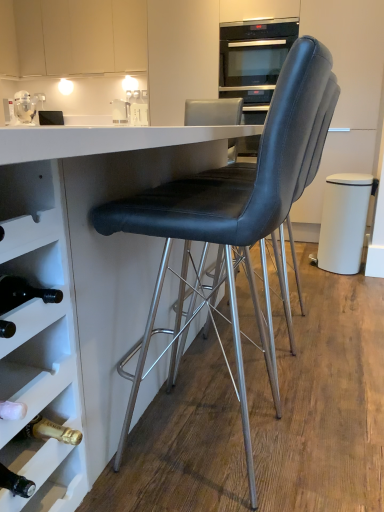
Where is `vacant region to the right of black leather chair at center, the 2th chair in the front-to-back sequence`? The image size is (384, 512). vacant region to the right of black leather chair at center, the 2th chair in the front-to-back sequence is located at coordinates pos(347,318).